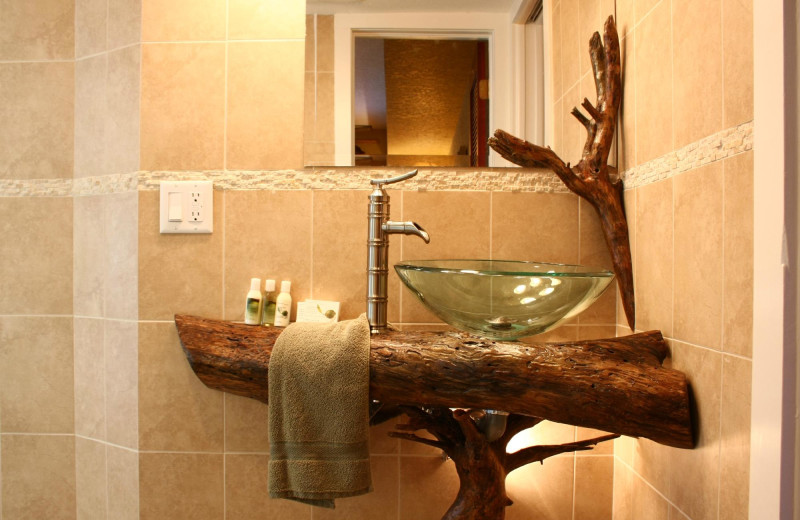
You are a GUI agent. You are given a task and a screenshot of the screen. Output one action in this format:
    pyautogui.click(x=<x>, y=<y>)
    Task: Click on the towel
    Image resolution: width=800 pixels, height=520 pixels.
    Given the screenshot: What is the action you would take?
    pyautogui.click(x=316, y=406)